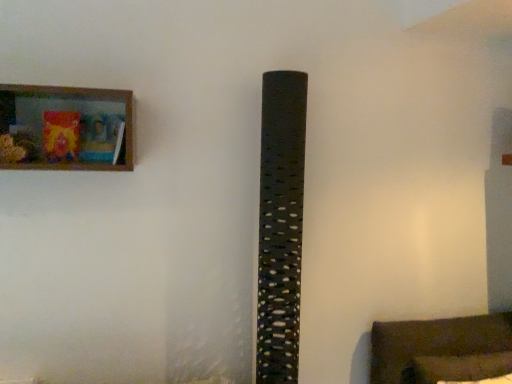
You are a GUI agent. You are given a task and a screenshot of the screen. Output one action in this format:
    pyautogui.click(x=<x>, y=<y>)
    Task: Click on the brown leather couch at lower right
    The image size is (512, 384).
    Given the screenshot: What is the action you would take?
    pyautogui.click(x=441, y=349)

What do you see at coordinates (441, 349) in the screenshot? This screenshot has height=384, width=512. I see `brown leather couch at lower right` at bounding box center [441, 349].

From the picture: What is the approximate height of brown leather couch at lower right?

32.03 centimeters.

What is the approximate width of brown leather couch at lower right?

The width of brown leather couch at lower right is 10.81 inches.

Where is `brown leather couch at lower right`? brown leather couch at lower right is located at coordinates (441, 349).